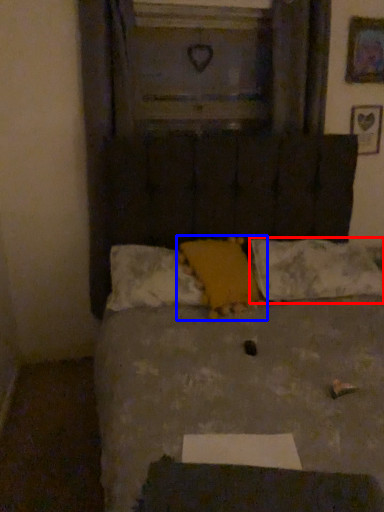
Question: Which object is closer to the camera taking this photo, pillow (highlighted by a red box) or pillow (highlighted by a blue box)?

Choices:
 (A) pillow
 (B) pillow

Answer: (B)